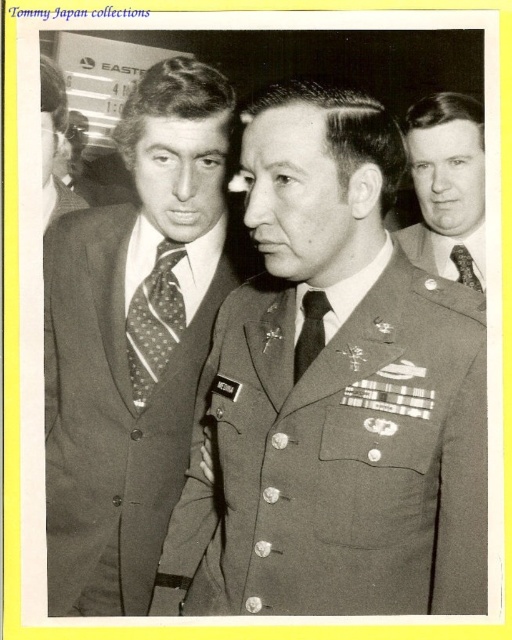
Question: Where is matte black suit at center located in relation to black silk tie at center in the image?

Choices:
 (A) below
 (B) above

Answer: (A)

Question: Which point is farther from the camera taking this photo?

Choices:
 (A) (152, 362)
 (B) (468, 524)
 (C) (42, 189)

Answer: (C)

Question: Does matte black suit at center have a larger size compared to polished dark suit at center?

Choices:
 (A) yes
 (B) no

Answer: (A)

Question: Does smooth gray suit at right have a lesser width compared to polka dot tie at left?

Choices:
 (A) no
 (B) yes

Answer: (B)

Question: Among these points, which one is farthest from the camera?

Choices:
 (A) (172, 317)
 (B) (51, 186)
 (C) (397, 172)
 (D) (467, 205)

Answer: (B)

Question: Among these objects, which one is farthest from the camera?

Choices:
 (A) polka dot silk tie at center
 (B) polka dot silk tie at left

Answer: (A)